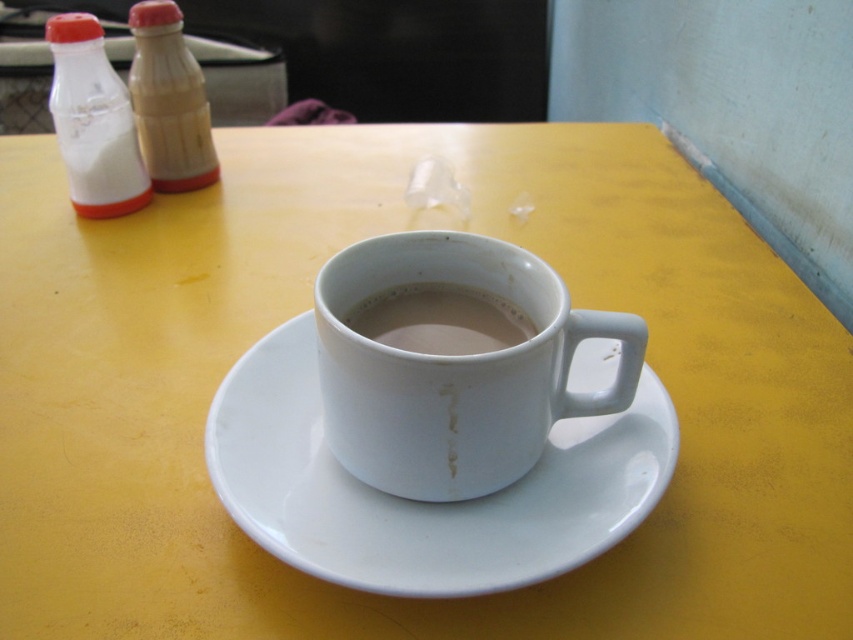
Does point (335, 394) lie behind point (397, 342)?

No, (335, 394) is closer to viewer.

Does point (410, 248) come closer to viewer compared to point (403, 308)?

That is True.

Locate an element on the screen. This screenshot has height=640, width=853. white glossy mug at center is located at coordinates (456, 368).

Who is taller, white ceramic saucer at center or white matte cup at center?

white ceramic saucer at center

Is point (630, 429) in front of point (463, 289)?

That is True.

Who is more forward, (488, 532) or (498, 308)?

Point (488, 532) is more forward.

The width and height of the screenshot is (853, 640). In order to click on white ceramic saucer at center in this screenshot , I will do `click(422, 502)`.

Between matte plastic bottle at left and white matte cup at center, which one is positioned higher?

matte plastic bottle at left

Is matte plastic bottle at left smaller than white matte cup at center?

No, matte plastic bottle at left is not smaller than white matte cup at center.

Identify the location of matte plastic bottle at left. (169, 100).

Find the location of a particular element. matte plastic bottle at left is located at coordinates (169, 100).